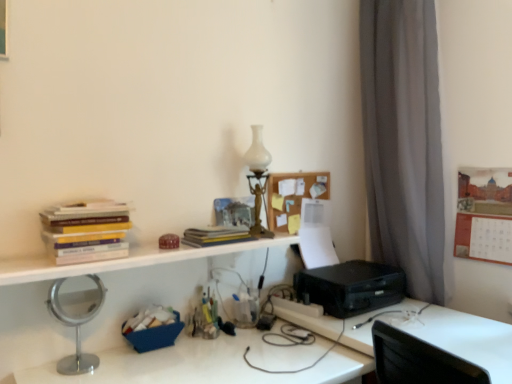
Question: Does black plastic printer at right appear on the right side of silver metallic mirror at lower left?

Choices:
 (A) no
 (B) yes

Answer: (B)

Question: From a real-world perspective, is black plastic printer at right below silver metallic mirror at lower left?

Choices:
 (A) yes
 (B) no

Answer: (B)

Question: Is black plastic printer at right at the left side of silver metallic mirror at lower left?

Choices:
 (A) yes
 (B) no

Answer: (B)

Question: Considering the relative sizes of black plastic printer at right and silver metallic mirror at lower left in the image provided, is black plastic printer at right smaller than silver metallic mirror at lower left?

Choices:
 (A) no
 (B) yes

Answer: (B)

Question: Can you confirm if black plastic printer at right is thinner than silver metallic mirror at lower left?

Choices:
 (A) yes
 (B) no

Answer: (A)

Question: Considering the positions of point (170, 240) and point (438, 311), is point (170, 240) closer or farther from the camera than point (438, 311)?

Choices:
 (A) farther
 (B) closer

Answer: (B)

Question: In terms of width, does matte brown box at center, which is the third stationery in bottom-to-top order, look wider or thinner when compared to silver metallic mirror at lower left?

Choices:
 (A) wide
 (B) thin

Answer: (B)

Question: From a real-world perspective, is matte brown box at center, which is the third stationery in bottom-to-top order, physically located above or below silver metallic mirror at lower left?

Choices:
 (A) above
 (B) below

Answer: (A)

Question: Is matte brown box at center, which is the third stationery in bottom-to-top order, inside the boundaries of silver metallic mirror at lower left, or outside?

Choices:
 (A) inside
 (B) outside

Answer: (B)

Question: Is wooden corkboard at upper center situated inside silver metallic mirror at lower left or outside?

Choices:
 (A) inside
 (B) outside

Answer: (B)

Question: From a real-world perspective, is wooden corkboard at upper center positioned above or below silver metallic mirror at lower left?

Choices:
 (A) below
 (B) above

Answer: (B)

Question: Does point (266, 187) appear closer or farther from the camera than point (371, 337)?

Choices:
 (A) farther
 (B) closer

Answer: (A)

Question: From the image's perspective, is wooden corkboard at upper center positioned above or below silver metallic mirror at lower left?

Choices:
 (A) below
 (B) above

Answer: (B)

Question: Is translucent plastic container at center, which is the second stationery in top-to-bottom order, situated inside white glass table lamp at upper center or outside?

Choices:
 (A) outside
 (B) inside

Answer: (A)

Question: Based on their sizes in the image, would you say translucent plastic container at center, which is the 2th stationery in bottom-to-top order, is bigger or smaller than white glass table lamp at upper center?

Choices:
 (A) big
 (B) small

Answer: (B)